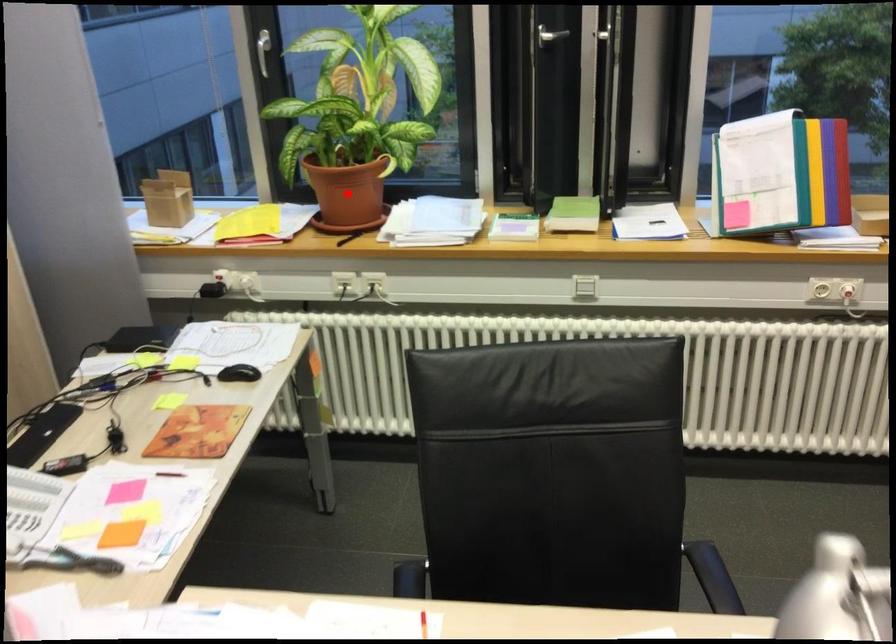
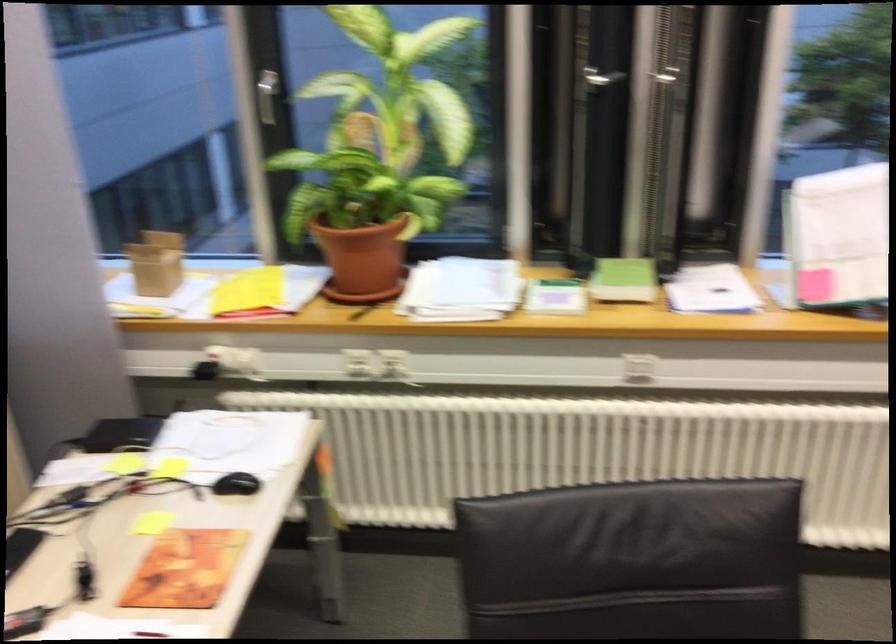
Where in the second image is the point corresponding to the highlighted location from the first image?

(363, 257)